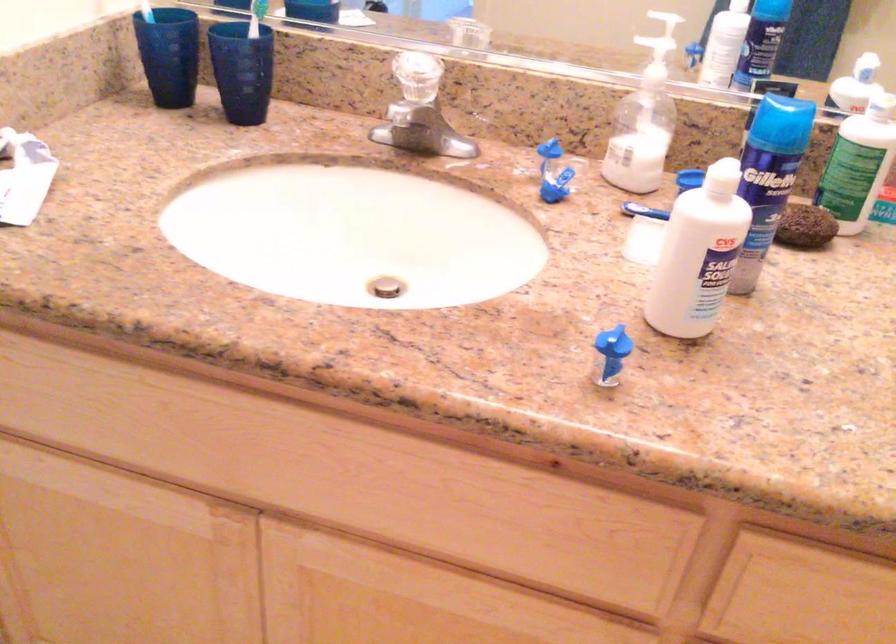
Image resolution: width=896 pixels, height=644 pixels. What do you see at coordinates (419, 111) in the screenshot? I see `the clear faucet handle` at bounding box center [419, 111].